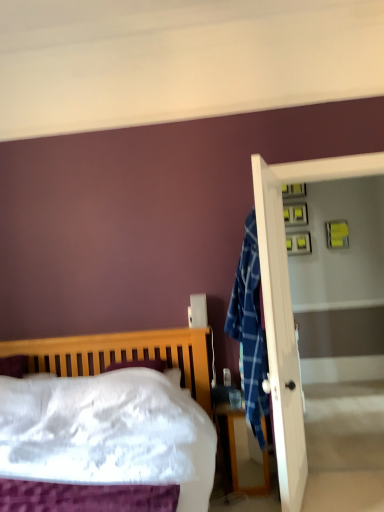
Question: Is wooden bed at left outside white glossy screen door at right?

Choices:
 (A) no
 (B) yes

Answer: (B)

Question: Can you confirm if wooden bed at left is thinner than white glossy screen door at right?

Choices:
 (A) no
 (B) yes

Answer: (A)

Question: Considering the relative sizes of wooden bed at left and white glossy screen door at right in the image provided, is wooden bed at left smaller than white glossy screen door at right?

Choices:
 (A) yes
 (B) no

Answer: (B)

Question: From a real-world perspective, is wooden bed at left positioned under white glossy screen door at right based on gravity?

Choices:
 (A) no
 (B) yes

Answer: (B)

Question: Is wooden bed at left positioned far away from white glossy screen door at right?

Choices:
 (A) no
 (B) yes

Answer: (A)

Question: Is wooden nightstand at lower right inside or outside of wooden bed at left?

Choices:
 (A) outside
 (B) inside

Answer: (A)

Question: Is wooden nightstand at lower right in front of or behind wooden bed at left in the image?

Choices:
 (A) behind
 (B) front

Answer: (A)

Question: Is point (266, 472) positioned closer to the camera than point (110, 347)?

Choices:
 (A) closer
 (B) farther

Answer: (A)

Question: Would you say wooden nightstand at lower right is to the left or to the right of wooden bed at left in the picture?

Choices:
 (A) left
 (B) right

Answer: (B)

Question: From their relative heights in the image, would you say wooden nightstand at lower right is taller or shorter than white glossy screen door at right?

Choices:
 (A) short
 (B) tall

Answer: (A)

Question: From a real-world perspective, is wooden nightstand at lower right above or below white glossy screen door at right?

Choices:
 (A) above
 (B) below

Answer: (B)

Question: In terms of width, does wooden nightstand at lower right look wider or thinner when compared to white glossy screen door at right?

Choices:
 (A) thin
 (B) wide

Answer: (B)

Question: From the image's perspective, relative to white glossy screen door at right, is wooden nightstand at lower right above or below?

Choices:
 (A) below
 (B) above

Answer: (A)

Question: From a real-world perspective, relative to wooden nightstand at lower right, is wooden bed at left vertically above or below?

Choices:
 (A) above
 (B) below

Answer: (A)

Question: Is wooden bed at left to the left or to the right of wooden nightstand at lower right in the image?

Choices:
 (A) left
 (B) right

Answer: (A)